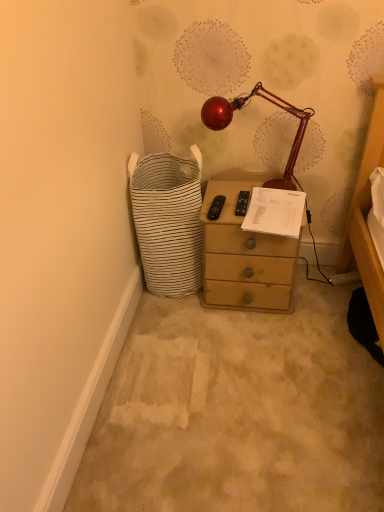
Question: Could you tell me if white striped fabric basket at lower left is facing matte brown chest of drawers at center?

Choices:
 (A) yes
 (B) no

Answer: (B)

Question: Is white striped fabric basket at lower left directly adjacent to matte brown chest of drawers at center?

Choices:
 (A) no
 (B) yes

Answer: (A)

Question: Considering the relative sizes of white striped fabric basket at lower left and matte brown chest of drawers at center in the image provided, is white striped fabric basket at lower left thinner than matte brown chest of drawers at center?

Choices:
 (A) no
 (B) yes

Answer: (A)

Question: Are white striped fabric basket at lower left and matte brown chest of drawers at center located far from each other?

Choices:
 (A) no
 (B) yes

Answer: (A)

Question: Does white striped fabric basket at lower left have a smaller size compared to matte brown chest of drawers at center?

Choices:
 (A) yes
 (B) no

Answer: (B)

Question: In terms of width, does matte brown chest of drawers at center look wider or thinner when compared to white striped fabric basket at lower left?

Choices:
 (A) wide
 (B) thin

Answer: (B)

Question: In the image, is matte brown chest of drawers at center positioned in front of or behind white striped fabric basket at lower left?

Choices:
 (A) front
 (B) behind

Answer: (B)

Question: From the image's perspective, is matte brown chest of drawers at center located above or below white striped fabric basket at lower left?

Choices:
 (A) above
 (B) below

Answer: (B)

Question: In terms of height, does matte brown chest of drawers at center look taller or shorter compared to white striped fabric basket at lower left?

Choices:
 (A) tall
 (B) short

Answer: (B)

Question: Is white striped fabric basket at lower left to the left or to the right of wooden drawer at center in the image?

Choices:
 (A) left
 (B) right

Answer: (A)

Question: From a real-world perspective, is white striped fabric basket at lower left physically located above or below wooden drawer at center?

Choices:
 (A) above
 (B) below

Answer: (A)

Question: Is white striped fabric basket at lower left bigger or smaller than wooden drawer at center?

Choices:
 (A) small
 (B) big

Answer: (B)

Question: From their relative heights in the image, would you say white striped fabric basket at lower left is taller or shorter than wooden drawer at center?

Choices:
 (A) tall
 (B) short

Answer: (A)

Question: Is wooden drawer at center bigger or smaller than matte brown chest of drawers at center?

Choices:
 (A) big
 (B) small

Answer: (B)

Question: Relative to matte brown chest of drawers at center, is wooden drawer at center in front or behind?

Choices:
 (A) front
 (B) behind

Answer: (A)